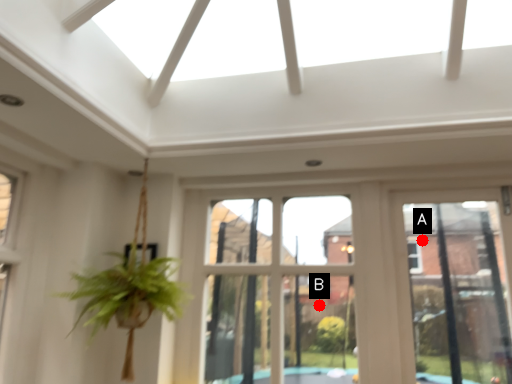
Question: Two points are circled on the image, labeled by A and B beside each circle. Which point appears closest to the camera in this image?

Choices:
 (A) A is closer
 (B) B is closer

Answer: (A)